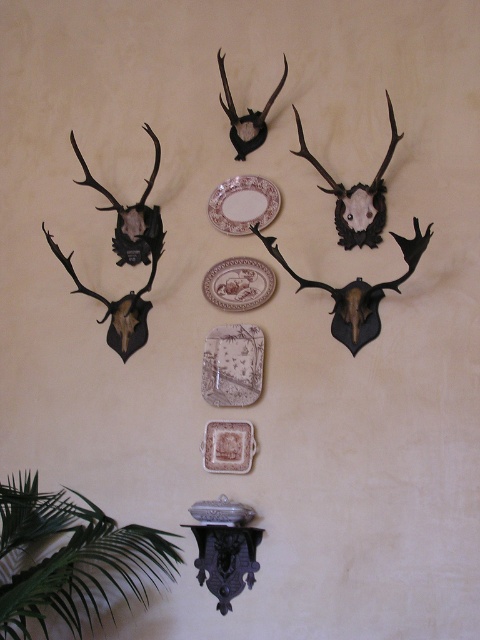
Question: Is porcelain plate at center thinner than metallic dark brown antler at upper right?

Choices:
 (A) no
 (B) yes

Answer: (B)

Question: Based on their relative distances, which object is nearer to the brown ceramic plate at center?

Choices:
 (A) metallic dark brown antler at upper right
 (B) porcelain plate at center
 (C) white glossy plate at upper center

Answer: (B)

Question: Which of the following is the farthest from the observer?

Choices:
 (A) (402, 134)
 (B) (230, 140)
 (C) (214, 448)

Answer: (B)

Question: Which point appears closest to the camera in this image?

Choices:
 (A) (249, 131)
 (B) (252, 436)
 (C) (363, 196)

Answer: (B)

Question: Is porcelain plate at center positioned before white glossy plate at upper center?

Choices:
 (A) no
 (B) yes

Answer: (B)

Question: Is metallic dark brown antler at upper right to the right of white glossy plate at upper center from the viewer's perspective?

Choices:
 (A) yes
 (B) no

Answer: (A)